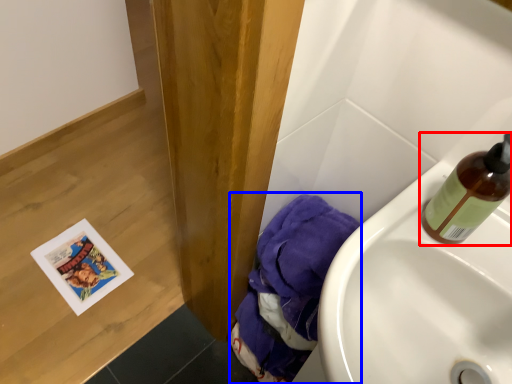
Question: Which object is closer to the camera taking this photo, bottle (highlighted by a red box) or material (highlighted by a blue box)?

Choices:
 (A) bottle
 (B) material

Answer: (A)